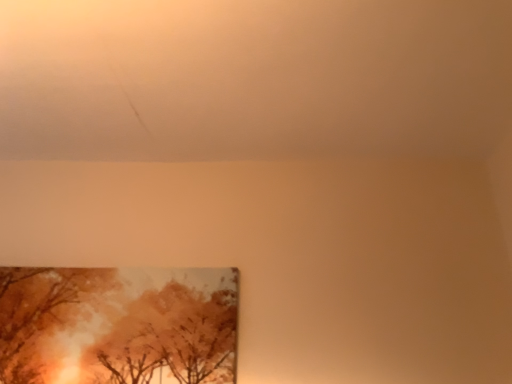
What do you see at coordinates (118, 325) in the screenshot? The width and height of the screenshot is (512, 384). I see `matte brown painting at lower left` at bounding box center [118, 325].

Measure the distance between point (19,351) and camera.

4.33 feet.

At what (x,y) coordinates should I click in order to perform the action: click on matte brown painting at lower left. Please return your answer as a coordinate pair (x, y). Looking at the image, I should click on (118, 325).

Identify the location of matte brown painting at lower left. The image size is (512, 384). (118, 325).